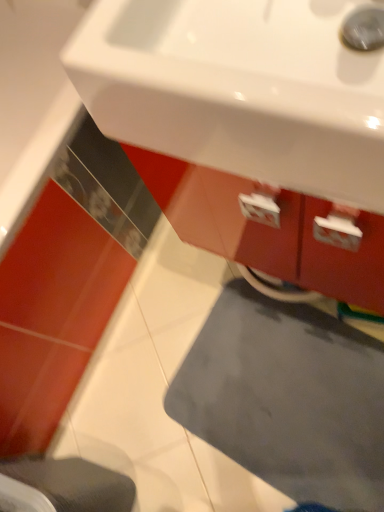
I want to click on free space to the left of gray matte bath mat at lower center, so click(150, 438).